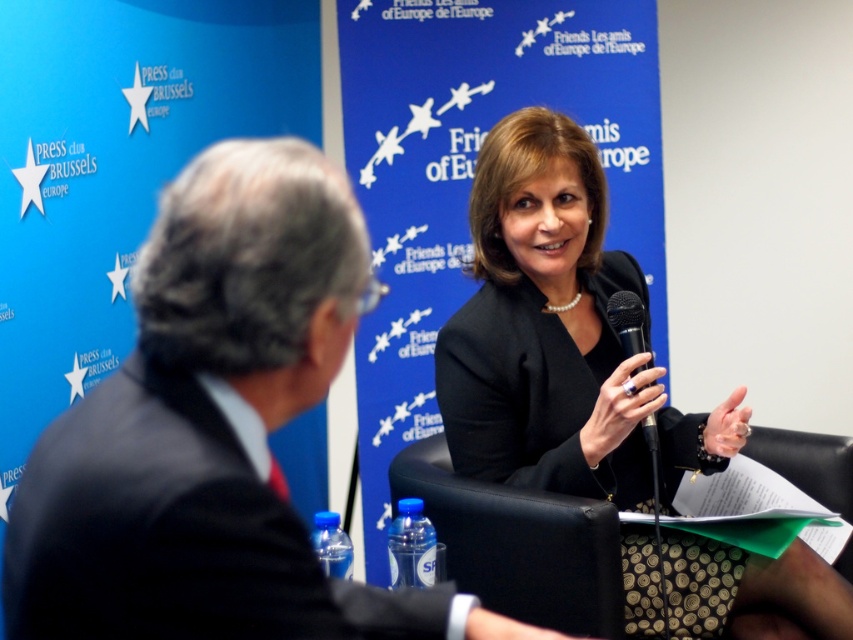
You are organizing a photo shoot and need to place two models wearing the dark suit at center and the dark blue fabric suit at right in a row. Based on the scene description, which model should stand first if you want the wider suit to be on the left side?

The dark suit at center should stand first on the left side because its width is larger than the dark blue fabric suit at right.

You are a photographer at the event and want to capture a closeup of the speaker. The speaker is wearing a dark blazer and a pearl necklace. You notice a point at coordinates point (213, 429). Where exactly is this point located on the speaker?

The point (213, 429) is located on the dark suit at center.

You are organizing a small meeting and need to decide whether to place a 20 cm wide decorative plate between the dark suit at center and the black metallic microphone at center. Given the size difference between them, will there be enough space for the plate?

The dark suit at center is bigger than the black metallic microphone at center, so there should be sufficient space between them to place a 20 cm wide decorative plate.